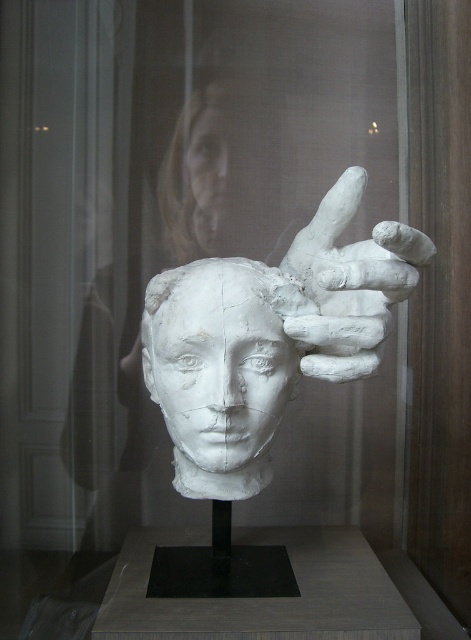
Where is `white clay face at center`? The height and width of the screenshot is (640, 471). white clay face at center is located at coordinates (219, 368).

Is white clay face at center bigger than smooth skin face at upper center?

Correct, white clay face at center is larger in size than smooth skin face at upper center.

Is point (245, 451) positioned before point (217, 196)?

Yes, it is in front of point (217, 196).

Find the location of a particular element. white clay face at center is located at coordinates (219, 368).

Does white clay head at upper center have a lesser height compared to smooth skin face at upper center?

In fact, white clay head at upper center may be taller than smooth skin face at upper center.

Between point (242, 244) and point (219, 172), which one is positioned in front?

Positioned in front is point (219, 172).

You are a GUI agent. You are given a task and a screenshot of the screen. Output one action in this format:
    pyautogui.click(x=<x>, y=<y>)
    Task: Click on the white clay head at upper center
    
    Given the screenshot: What is the action you would take?
    pyautogui.click(x=212, y=173)

Does point (378, 228) lie in front of point (203, 138)?

Yes, it is in front of point (203, 138).

Which is more to the right, white clay hand at upper center or smooth skin face at upper center?

From the viewer's perspective, white clay hand at upper center appears more on the right side.

Who is more forward, (360, 264) or (218, 109)?

Positioned in front is point (360, 264).

What are the coordinates of `white clay hand at upper center` in the screenshot? It's located at (350, 282).